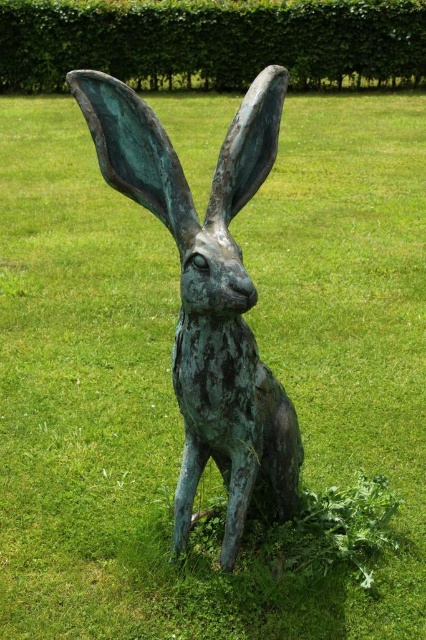
Question: Can you confirm if green patina bronze hare at center is bigger than green leafy hedge at upper center?

Choices:
 (A) no
 (B) yes

Answer: (A)

Question: Can you confirm if green patina bronze hare at center is positioned to the left of green leafy hedge at upper center?

Choices:
 (A) no
 (B) yes

Answer: (A)

Question: Which point is closer to the camera?

Choices:
 (A) (336, 6)
 (B) (253, 392)

Answer: (B)

Question: Which object is farther from the camera taking this photo?

Choices:
 (A) green patina bronze hare at center
 (B) green leafy hedge at upper center

Answer: (B)

Question: Is green patina bronze hare at center wider than green leafy hedge at upper center?

Choices:
 (A) yes
 (B) no

Answer: (B)